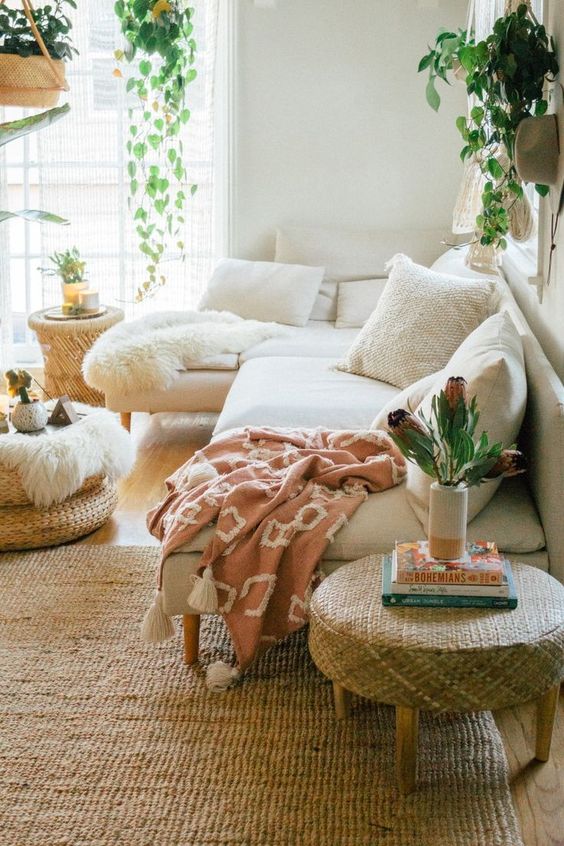
What are the coordinates of `books` in the screenshot? It's located at (440, 566), (440, 584), (440, 591).